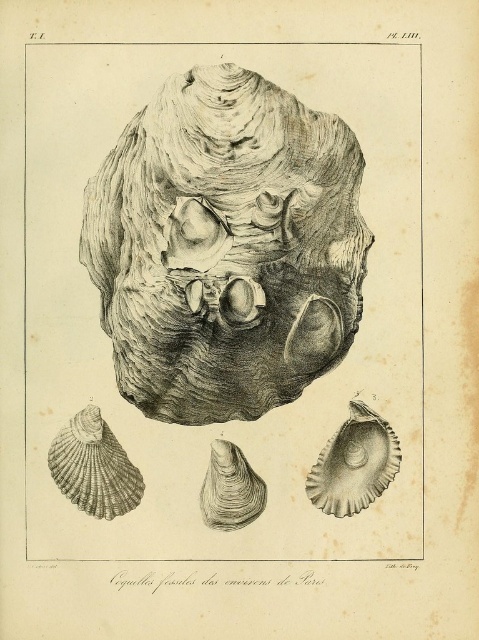
You are an archaeologist examining the fossilized shells in the image. You need to locate the smooth gray shell at lower right. According to the coordinates provided, where exactly is it positioned?

The smooth gray shell at lower right is located at point (353, 464).

You are examining a scientific illustration of fossilized shells. You see the smooth gray oyster at center and the smooth gray shell at lower right. Which one appears closer to you in the illustration?

The smooth gray shell at lower right appears closer because the smooth gray oyster at center is positioned behind it.